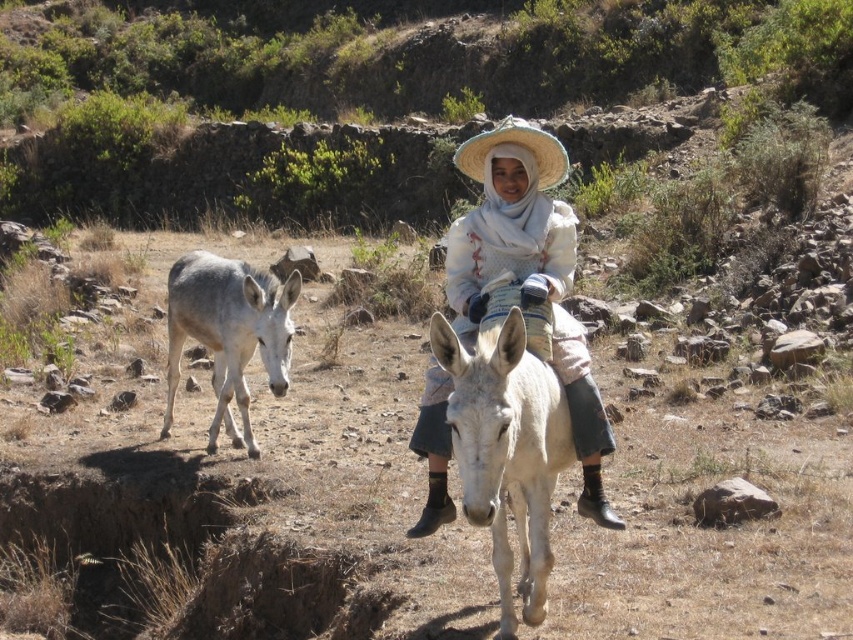
You are a photographer standing in the middle of the rocky terrain. You want to take a photo of the white matte donkey at center and the white matte donkey at left. Which donkey will appear larger in your photo?

The white matte donkey at center is closer to the viewer than the white matte donkey at left, so it will appear larger in the photo.

You are a traveler observing a person in the scene. The person is wearing a white cotton dress at center and a natural straw hat at center. Which item is located more to the left?

The white cotton dress at center is positioned on the left side of the natural straw hat at center, so the white cotton dress at center is more to the left.

You are a photographer trying to capture the scene with a camera that has a limited depth of field. You want to focus on the white cotton dress at center and the white matte donkey at left. Which object should you focus on first if you want the thinner one to be in sharp focus?

The white cotton dress at center is thinner than the white matte donkey at left, so you should focus on the white cotton dress at center first to ensure it is in sharp focus.